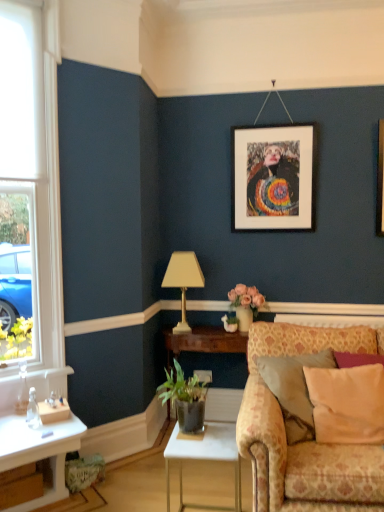
Question: Considering the positions of white glossy table at center and white matte picture frame at upper center in the image, is white glossy table at center bigger or smaller than white matte picture frame at upper center?

Choices:
 (A) small
 (B) big

Answer: (B)

Question: Considering the positions of white glossy table at center and white matte picture frame at upper center in the image, is white glossy table at center taller or shorter than white matte picture frame at upper center?

Choices:
 (A) short
 (B) tall

Answer: (A)

Question: Estimate the real-world distances between objects in this image. Which object is farther from the gold metallic table lamp at center?

Choices:
 (A) green leafy plant in terracotta pot at lower center
 (B) white glossy table at center
 (C) beige fabric pillow at right
 (D) floral-patterned fabric couch at lower right
 (E) white matte picture frame at upper center

Answer: (C)

Question: Estimate the real-world distances between objects in this image. Which object is farther from the floral-patterned fabric couch at lower right?

Choices:
 (A) white matte picture frame at upper center
 (B) green leafy plant in terracotta pot at lower center
 (C) white glossy table at center
 (D) beige fabric pillow at right
 (E) gold metallic table lamp at center

Answer: (A)